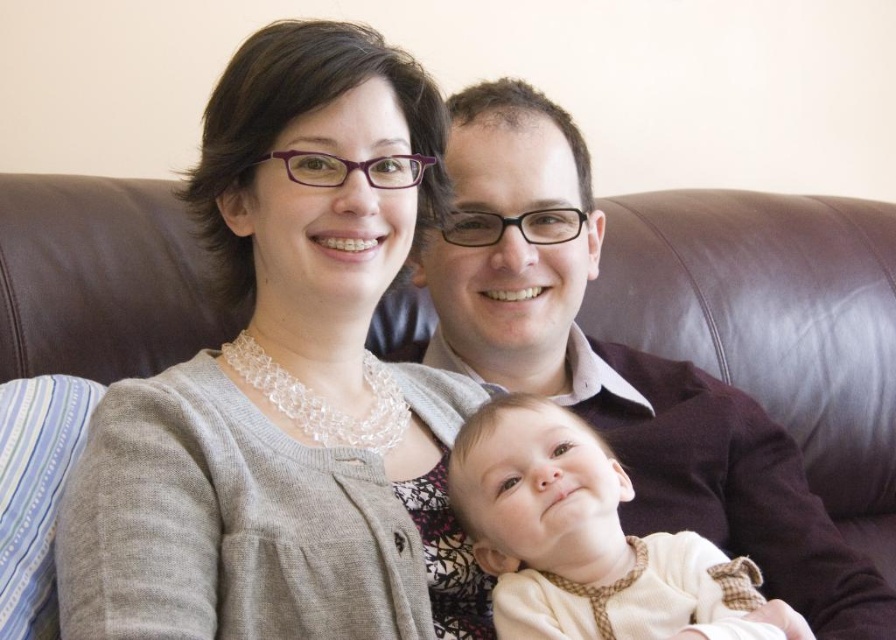
Can you confirm if gray knitted sweater at upper left is positioned above light beige soft fabric baby at center?

Correct, gray knitted sweater at upper left is located above light beige soft fabric baby at center.

Is gray knitted sweater at upper left shorter than light beige soft fabric baby at center?

No.

Which is in front, point (102, 611) or point (660, 579)?

Point (102, 611)

This screenshot has height=640, width=896. Find the location of `gray knitted sweater at upper left`. gray knitted sweater at upper left is located at coordinates (261, 518).

Can you confirm if matte brown leather couch at center is taller than light beige soft fabric baby at center?

Yes.

Is matte brown leather couch at center positioned behind light beige soft fabric baby at center?

Yes, matte brown leather couch at center is behind light beige soft fabric baby at center.

Between point (544, 115) and point (582, 602), which one is positioned in front?

Positioned in front is point (582, 602).

Locate an element on the screen. The image size is (896, 640). matte brown leather couch at center is located at coordinates (619, 362).

Does gray knitted sweater at upper left have a lesser width compared to matte brown leather couch at center?

Yes, gray knitted sweater at upper left is thinner than matte brown leather couch at center.

Who is lower down, gray knitted sweater at upper left or matte brown leather couch at center?

matte brown leather couch at center is below.

Does point (229, 109) lie behind point (695, 440)?

No.

Locate an element on the screen. gray knitted sweater at upper left is located at coordinates (261, 518).